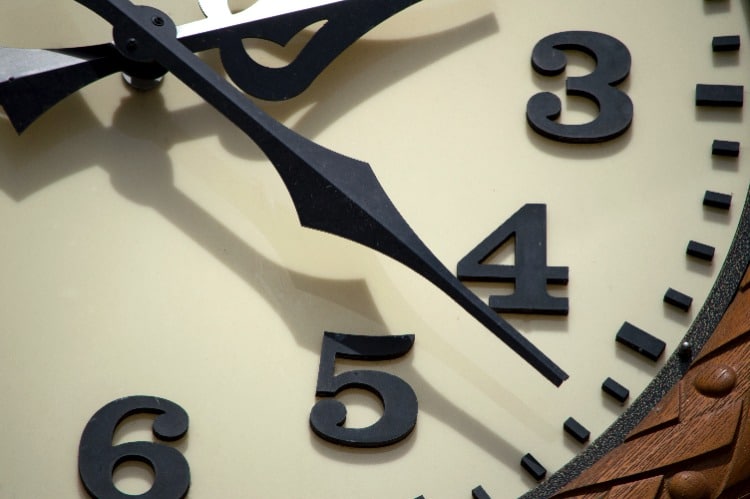
You are a GUI agent. You are given a task and a screenshot of the screen. Output one action in this format:
    pyautogui.click(x=<x>, y=<y>)
    Task: Click on the tan clock face
    
    Given the screenshot: What is the action you would take?
    pyautogui.click(x=30, y=182), pyautogui.click(x=27, y=455), pyautogui.click(x=512, y=462), pyautogui.click(x=705, y=32)